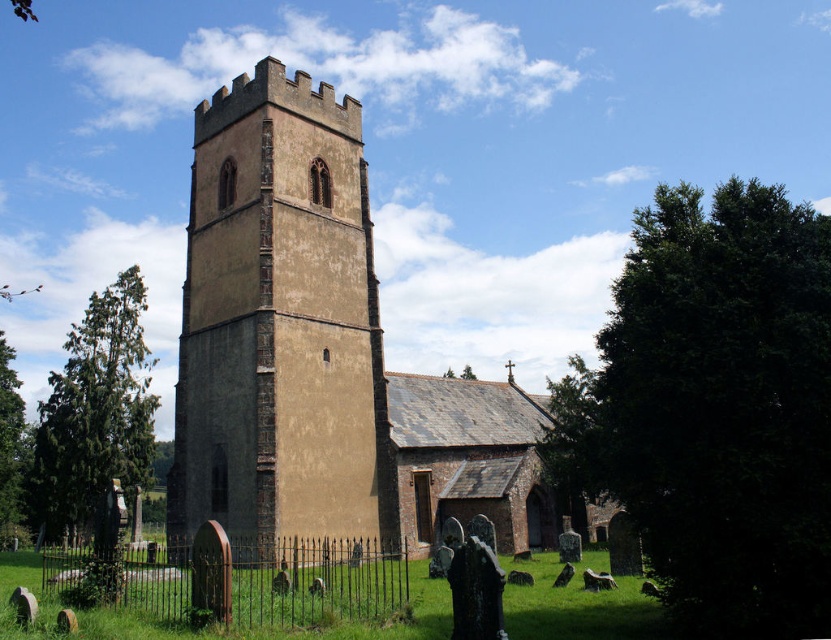
Does point (225, 340) come in front of point (369, 454)?

Yes, it is in front of point (369, 454).

Is brown stone church at center to the left of brown stone tower at center from the viewer's perspective?

Incorrect, brown stone church at center is not on the left side of brown stone tower at center.

Who is more distant from viewer, (237, 392) or (263, 77)?

Point (263, 77)

I want to click on brown stone church at center, so click(x=325, y=355).